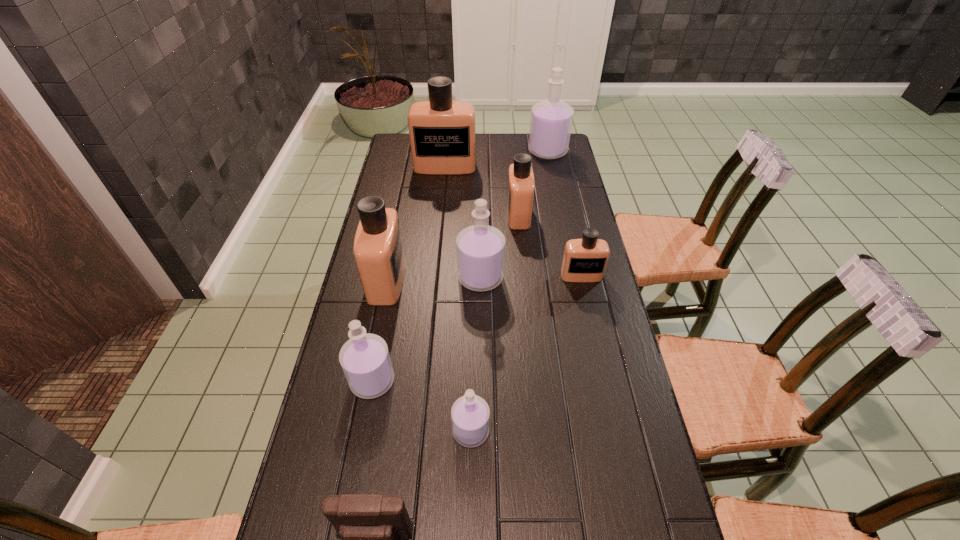
The height and width of the screenshot is (540, 960). In order to click on free space between the smallest purple perfume and the second smallest beige perfume in this screenshot , I will do `click(494, 323)`.

Locate an element on the screen. empty space that is in between the smallest beige perfume and the smallest purple perfume is located at coordinates (526, 353).

Identify which object is the closest to the nearest object. Please provide its 2D coordinates. Your answer should be formatted as a tuple, i.e. [(x, y)], where the tuple contains the x and y coordinates of a point satisfying the conditions above.

[(470, 414)]

Find the location of a particular element. This screenshot has height=540, width=960. object that is the third closest to the leftmost purple perfume is located at coordinates (373, 528).

Point out which perfume is positioned as the nearest to the farthest beige perfume. Please provide its 2D coordinates. Your answer should be formatted as a tuple, i.e. [(x, y)], where the tuple contains the x and y coordinates of a point satisfying the conditions above.

[(520, 192)]

Identify which perfume is located as the third nearest to the third nearest purple perfume. Please provide its 2D coordinates. Your answer should be formatted as a tuple, i.e. [(x, y)], where the tuple contains the x and y coordinates of a point satisfying the conditions above.

[(585, 260)]

Select which purple perfume appears as the fourth closest to the seventh nearest object. Please provide its 2D coordinates. Your answer should be formatted as a tuple, i.e. [(x, y)], where the tuple contains the x and y coordinates of a point satisfying the conditions above.

[(470, 414)]

Locate which purple perfume is the third closest to the pouch. Please provide its 2D coordinates. Your answer should be formatted as a tuple, i.e. [(x, y)], where the tuple contains the x and y coordinates of a point satisfying the conditions above.

[(480, 248)]

Locate an element on the screen. The height and width of the screenshot is (540, 960). the closest beige perfume to the nearest object is located at coordinates (378, 250).

Where is `beige perfume identified as the third closest to the rightmost purple perfume`? Image resolution: width=960 pixels, height=540 pixels. beige perfume identified as the third closest to the rightmost purple perfume is located at coordinates (585, 260).